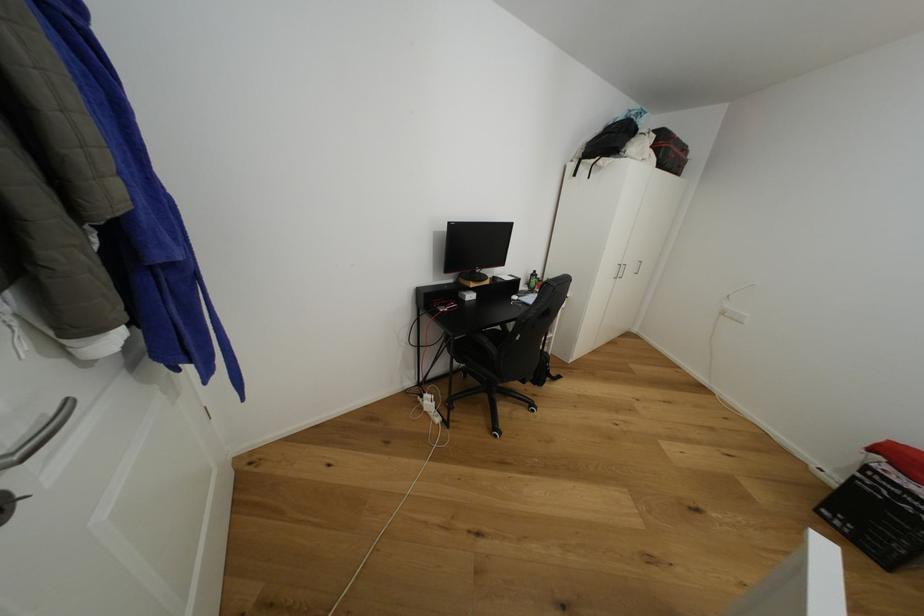
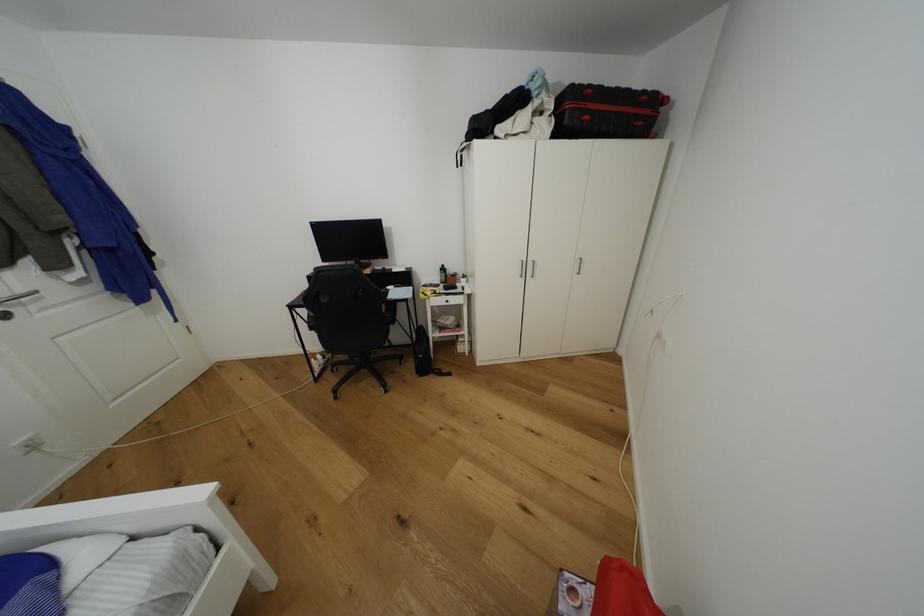
Question: The images are taken continuously from a first-person perspective. In which direction are you moving?

Choices:
 (A) Left
 (B) Right
 (C) Forward
 (D) Backward

Answer: (B)